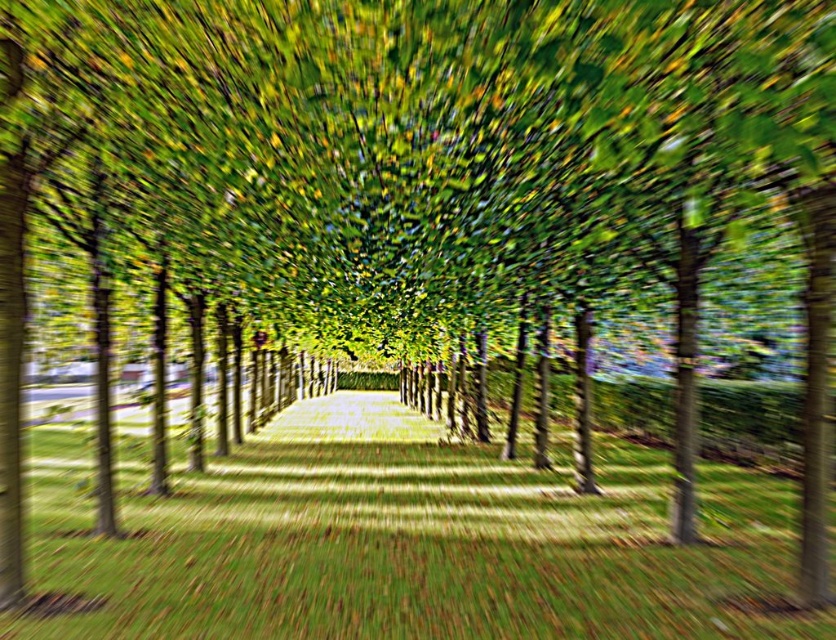
Can you confirm if green grass at center is taller than green leafy canopy at center?

Indeed, green grass at center has a greater height compared to green leafy canopy at center.

Describe the element at coordinates (406, 540) in the screenshot. This screenshot has width=836, height=640. I see `green grass at center` at that location.

What do you see at coordinates (406, 540) in the screenshot?
I see `green grass at center` at bounding box center [406, 540].

Find the location of a particular element. Image resolution: width=836 pixels, height=640 pixels. green grass at center is located at coordinates (406, 540).